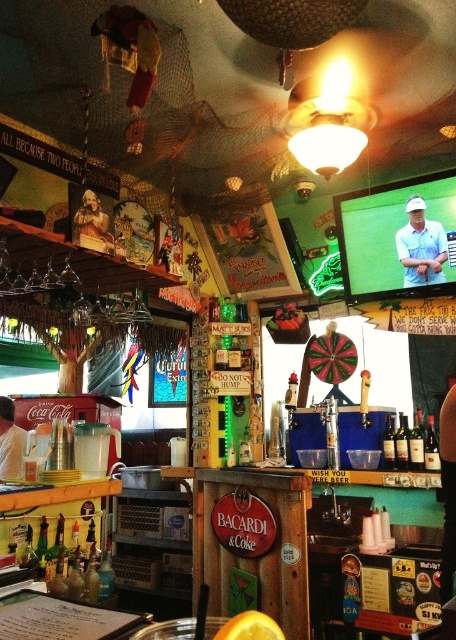
Which is behind, point (436, 259) or point (5, 419)?

Positioned behind is point (5, 419).

Is point (407, 259) more distant than point (13, 451)?

No, it is not.

In the scene shown: Who is more distant from viewer, (405, 280) or (5, 458)?

Point (5, 458)

The height and width of the screenshot is (640, 456). Identify the location of matte blue shirt at center. (420, 246).